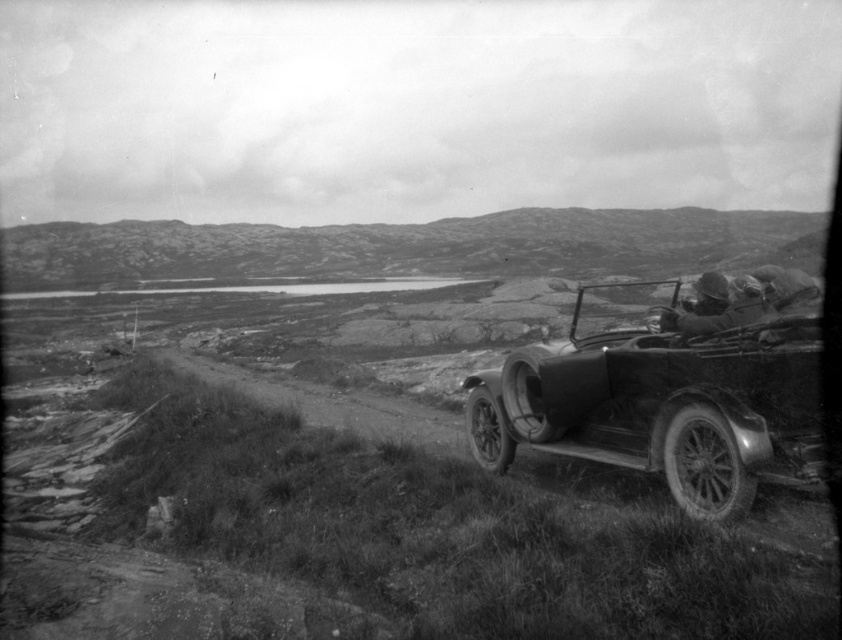
Question: Is shiny chrome car at right above dirt/gritty road at lower left?

Choices:
 (A) no
 (B) yes

Answer: (B)

Question: Which point is farther to the camera?

Choices:
 (A) rugged stone hillside at upper center
 (B) shiny chrome car at right

Answer: (A)

Question: Which object is the closest to the rugged stone hillside at upper center?

Choices:
 (A) dirt/gritty road at lower left
 (B) shiny chrome car at right

Answer: (A)

Question: Is shiny chrome car at right to the left of rugged stone hillside at upper center from the viewer's perspective?

Choices:
 (A) yes
 (B) no

Answer: (B)

Question: Among these points, which one is farthest from the camera?

Choices:
 (A) (569, 353)
 (B) (312, 392)

Answer: (B)

Question: Is rugged stone hillside at upper center wider than dirt/gritty road at lower left?

Choices:
 (A) yes
 (B) no

Answer: (A)